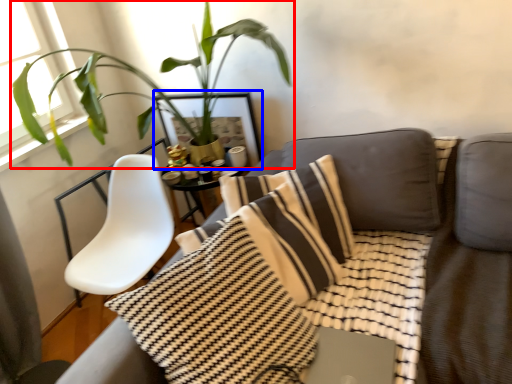
Question: Which object is further to the camera taking this photo, houseplant (highlighted by a red box) or picture frame (highlighted by a blue box)?

Choices:
 (A) houseplant
 (B) picture frame

Answer: (B)